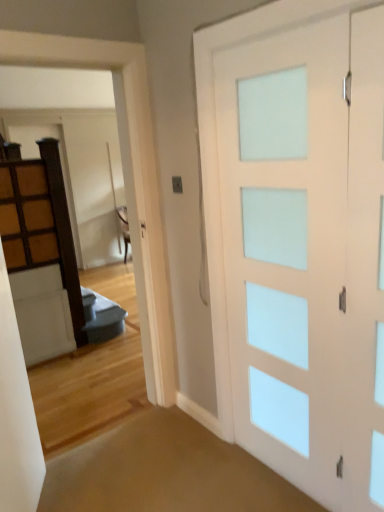
Question: Considering the relative sizes of wooden cabinet at left and white frosted glass barn door at right in the image provided, is wooden cabinet at left shorter than white frosted glass barn door at right?

Choices:
 (A) no
 (B) yes

Answer: (B)

Question: Is wooden cabinet at left next to white frosted glass barn door at right?

Choices:
 (A) no
 (B) yes

Answer: (A)

Question: Is the position of wooden cabinet at left less distant than that of white frosted glass barn door at right?

Choices:
 (A) no
 (B) yes

Answer: (A)

Question: Is wooden cabinet at left at the left side of white frosted glass barn door at right?

Choices:
 (A) yes
 (B) no

Answer: (A)

Question: Can you confirm if wooden cabinet at left is smaller than white frosted glass barn door at right?

Choices:
 (A) no
 (B) yes

Answer: (B)

Question: From the image's perspective, is wooden cabinet at left below white frosted glass barn door at right?

Choices:
 (A) yes
 (B) no

Answer: (B)

Question: Is wooden cabinet at left shorter than white frosted glass door at upper center?

Choices:
 (A) no
 (B) yes

Answer: (B)

Question: Can you confirm if wooden cabinet at left is bigger than white frosted glass door at upper center?

Choices:
 (A) no
 (B) yes

Answer: (A)

Question: Is white frosted glass door at upper center surrounded by wooden cabinet at left?

Choices:
 (A) yes
 (B) no

Answer: (B)

Question: Is wooden cabinet at left oriented towards white frosted glass door at upper center?

Choices:
 (A) yes
 (B) no

Answer: (A)

Question: Is wooden cabinet at left smaller than white frosted glass door at upper center?

Choices:
 (A) no
 (B) yes

Answer: (B)

Question: Does wooden cabinet at left have a lesser width compared to white frosted glass door at upper center?

Choices:
 (A) yes
 (B) no

Answer: (A)

Question: Does white frosted glass door at upper center have a lesser height compared to wooden cabinet at left?

Choices:
 (A) yes
 (B) no

Answer: (B)